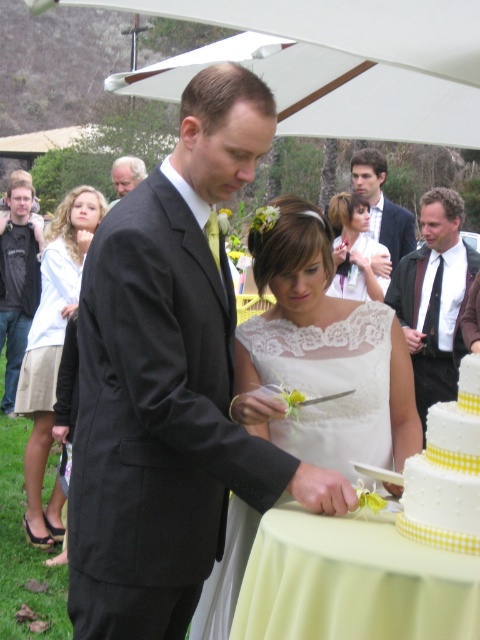
Question: Which point is farther to the camera?

Choices:
 (A) yellow fabric tablecloth at lower center
 (B) brown leather jacket at center
 (C) brushed metal jacket at left
 (D) gray hair at upper left

Answer: (C)

Question: Which point is closer to the camera?

Choices:
 (A) smooth brown suit at upper right
 (B) light beige fabric dress at center
 (C) brown leather jacket at center

Answer: (B)

Question: Does brushed metal jacket at left appear under smooth brown suit at upper right?

Choices:
 (A) yes
 (B) no

Answer: (A)

Question: Which object is positioned closest to the yellow checkered fabric at lower right?

Choices:
 (A) yellow fabric tablecloth at lower center
 (B) light beige fabric dress at center
 (C) black satin suit at center
 (D) gray hair at upper left

Answer: (A)

Question: Is light beige fabric dress at center wider than yellow checkered fabric at lower right?

Choices:
 (A) no
 (B) yes

Answer: (B)

Question: Does yellow fabric tablecloth at lower center appear on the left side of gray hair at upper left?

Choices:
 (A) yes
 (B) no

Answer: (B)